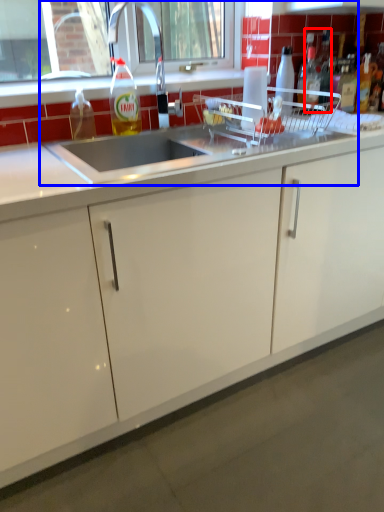
Question: Which object is closer to the camera taking this photo, bottle (highlighted by a red box) or sink (highlighted by a blue box)?

Choices:
 (A) bottle
 (B) sink

Answer: (B)